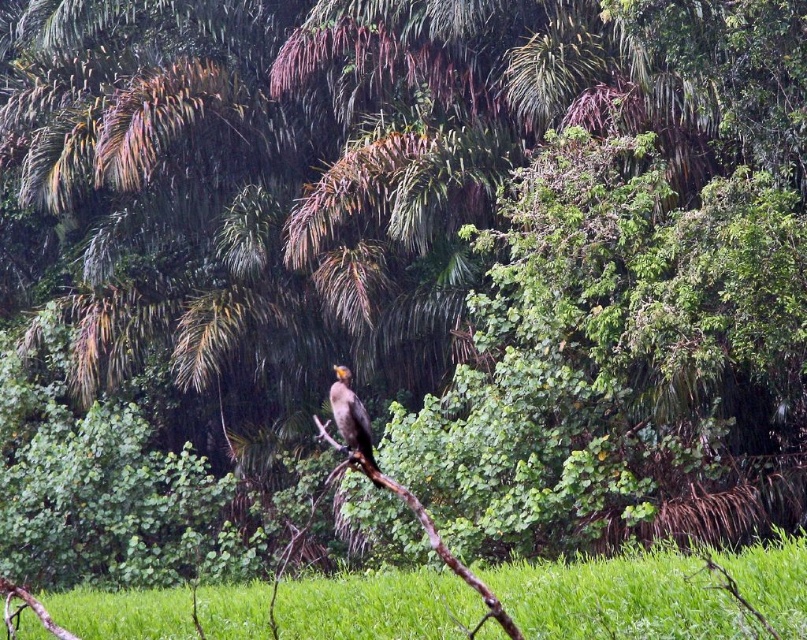
You are a small animal looking for shelter in the tropical forest scene. You see the green grass at lower center and the brown wood at center. Which one is closer to the ground?

The green grass at lower center is closer to the ground since it is positioned below the brown wood at center.

You are a hiker carrying a 36 inch long backpack. You want to place your backpack between the brown wood at center and the shiny brown bird at center. Can your backpack fit in the space between them?

The space between the brown wood at center and the shiny brown bird at center is 37.33 inches. Since your backpack is 36 inches long, it can fit in the space between them.